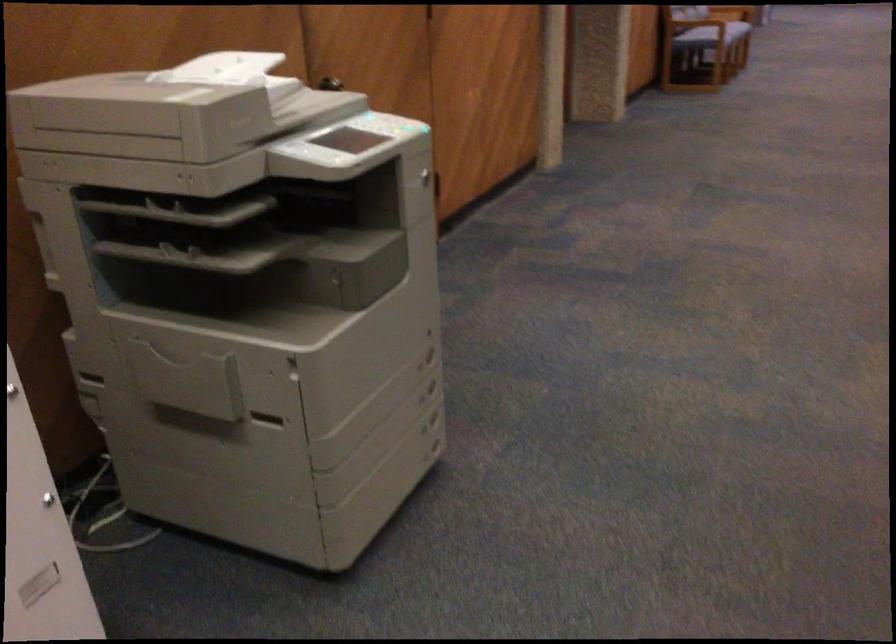
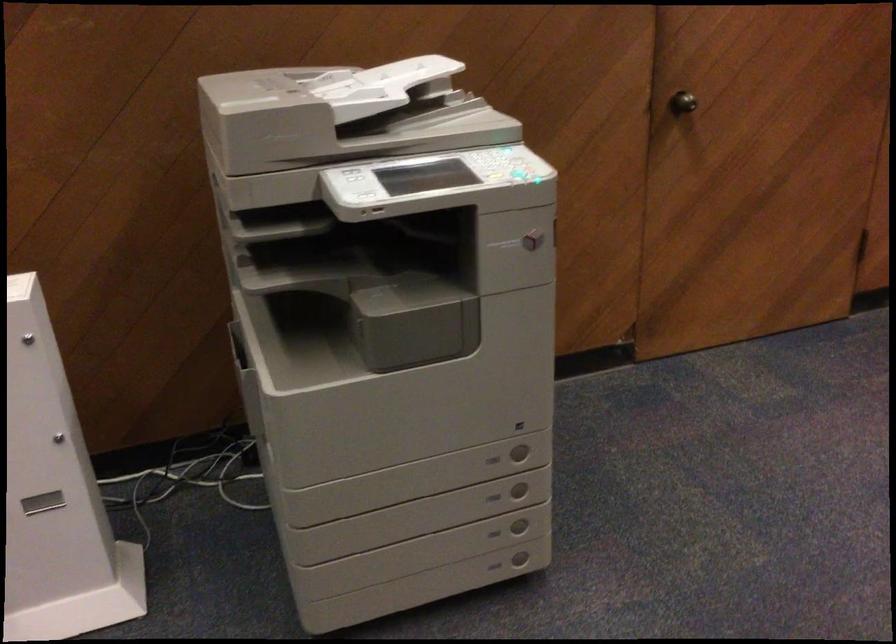
Where in the second image is the point corresponding to (342,84) from the first image?

(682, 102)